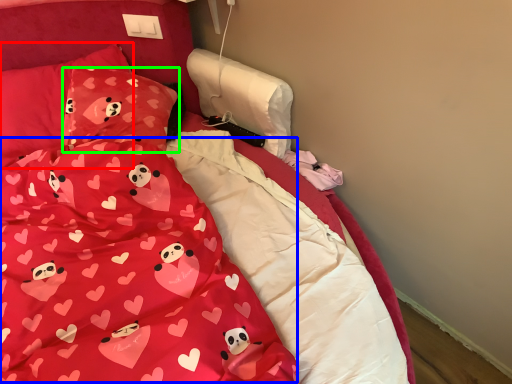
Question: Estimate the real-world distances between objects in this image. Which object is closer to pillow (highlighted by a red box), blanket (highlighted by a blue box) or pillow (highlighted by a green box)?

Choices:
 (A) blanket
 (B) pillow

Answer: (B)